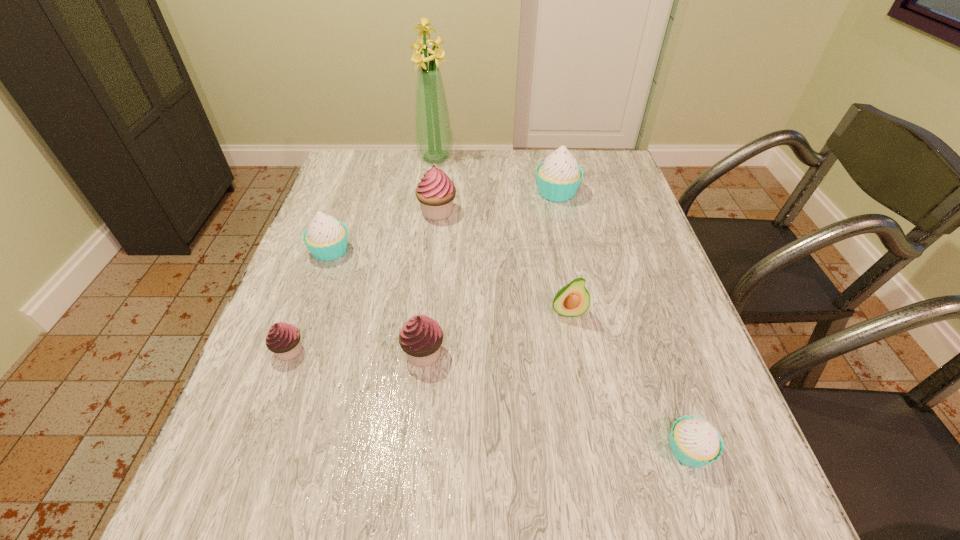
The width and height of the screenshot is (960, 540). I want to click on vacant region between the second smallest pink cupcake and the nearest object, so click(x=556, y=401).

Locate an element on the screen. vacant point located between the fifth cupcake from left to right and the rightmost object is located at coordinates (623, 321).

At what (x,y) coordinates should I click in order to perform the action: click on free space between the second cupcake from right to left and the green avocado. Please return your answer as a coordinate pair (x, y). Looking at the image, I should click on (563, 252).

At what (x,y) coordinates should I click in order to perform the action: click on free space between the second smallest white cupcake and the tallest object. Please return your answer as a coordinate pair (x, y). Image resolution: width=960 pixels, height=540 pixels. Looking at the image, I should click on (383, 204).

Locate an element on the screen. The image size is (960, 540). empty location between the second biggest pink cupcake and the biggest pink cupcake is located at coordinates (430, 283).

Where is `vacant space that is in between the nearest cupcake and the avocado`? This screenshot has width=960, height=540. vacant space that is in between the nearest cupcake and the avocado is located at coordinates (629, 381).

Where is `vacant space in between the second nearest white cupcake and the rightmost white cupcake`? This screenshot has width=960, height=540. vacant space in between the second nearest white cupcake and the rightmost white cupcake is located at coordinates (510, 350).

At what (x,y) coordinates should I click in order to perform the action: click on unoccupied area between the green avocado and the second white cupcake from left to right. Please return your answer as a coordinate pair (x, y). This screenshot has width=960, height=540. Looking at the image, I should click on (563, 252).

This screenshot has width=960, height=540. I want to click on free spot between the rightmost white cupcake and the biggest white cupcake, so click(623, 321).

Find the location of a particular element. blank region between the biggest white cupcake and the second smallest pink cupcake is located at coordinates (490, 273).